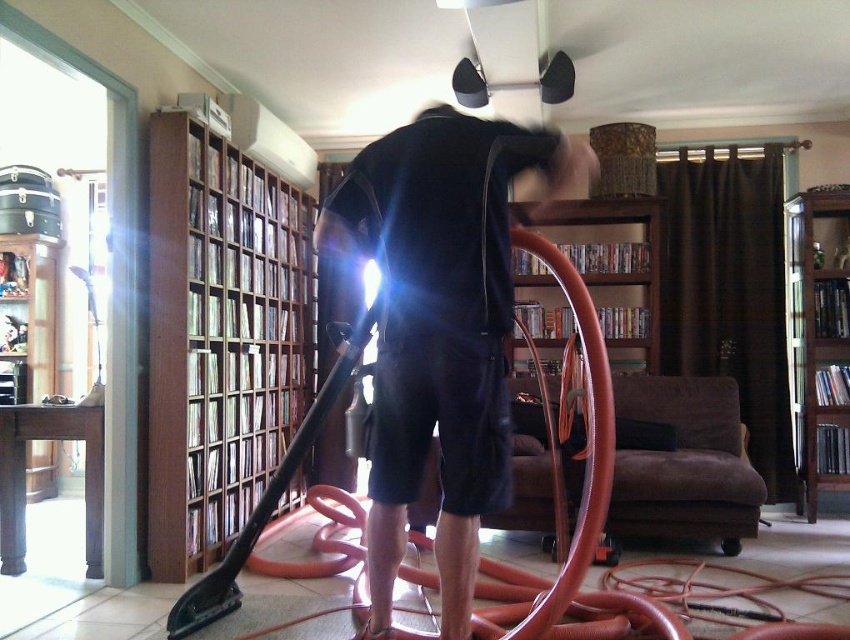
Question: Does brown wooden bookshelf at right have a larger size compared to wooden bookshelf at center?

Choices:
 (A) yes
 (B) no

Answer: (B)

Question: Which is nearer to the brown wooden bookshelf at left?

Choices:
 (A) brown wooden bookshelf at right
 (B) wooden bookshelf at center
 (C) dark blue fabric shirt at center
 (D) wooden bookshelf at left

Answer: (C)

Question: Which of the following is the farthest from the observer?

Choices:
 (A) (831, 412)
 (B) (225, 410)

Answer: (A)

Question: Can you confirm if brown wooden bookshelf at left is positioned to the left of brown wooden bookshelf at right?

Choices:
 (A) yes
 (B) no

Answer: (A)

Question: Which object is positioned farthest from the wooden bookshelf at center?

Choices:
 (A) dark blue fabric shirt at center
 (B) wooden bookshelf at left
 (C) brown wooden bookshelf at right
 (D) brown wooden bookshelf at left

Answer: (B)

Question: Considering the relative positions of brown wooden bookshelf at left and wooden bookshelf at left in the image provided, where is brown wooden bookshelf at left located with respect to wooden bookshelf at left?

Choices:
 (A) above
 (B) below

Answer: (B)